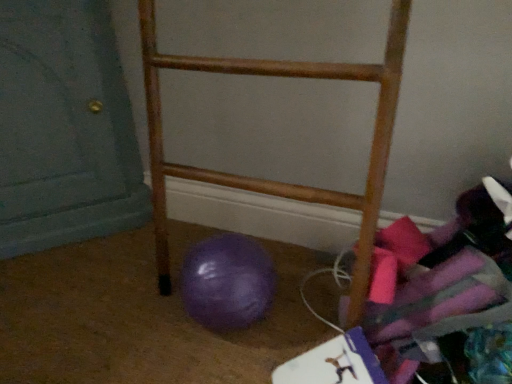
Question: Is purple rubber ball at lower left bigger or smaller than wooden rack at center?

Choices:
 (A) big
 (B) small

Answer: (B)

Question: Relative to wooden rack at center, is purple rubber ball at lower left in front or behind?

Choices:
 (A) front
 (B) behind

Answer: (B)

Question: Which is nearer to the purple rubber ball at lower left?

Choices:
 (A) matte teal door at lower left
 (B) wooden rack at center

Answer: (B)

Question: Which is nearer to the purple rubber ball at lower left?

Choices:
 (A) matte teal door at lower left
 (B) wooden rack at center

Answer: (B)